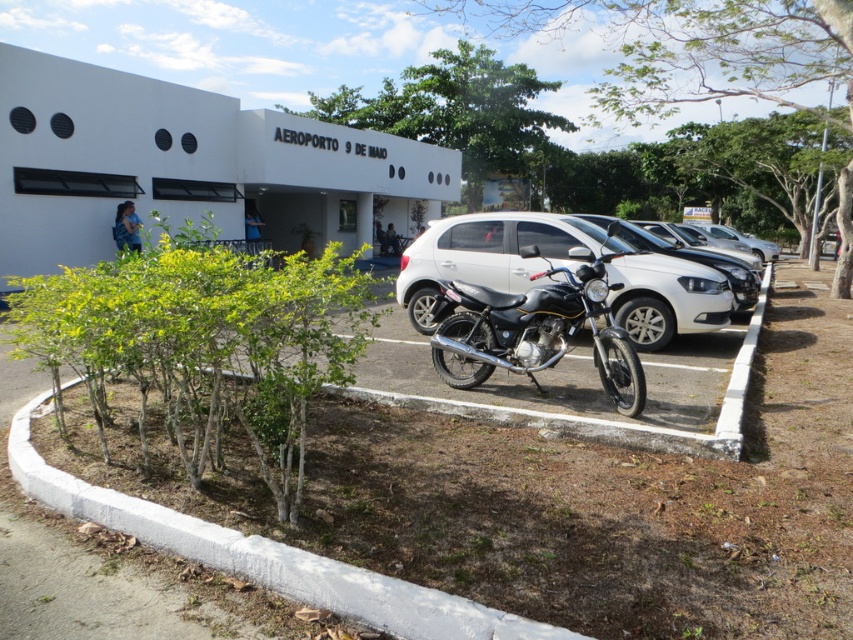
Question: Which point is closer to the camera?

Choices:
 (A) (454, 243)
 (B) (619, 230)

Answer: (A)

Question: Which of these objects is positioned farthest from the black matte motorcycle at center?

Choices:
 (A) glossy white sedan at center
 (B) satin white car at center

Answer: (A)

Question: Can you confirm if satin white car at center is bigger than black matte motorcycle at center?

Choices:
 (A) yes
 (B) no

Answer: (A)

Question: Is black matte motorcycle at center to the left of glossy white sedan at center from the viewer's perspective?

Choices:
 (A) yes
 (B) no

Answer: (A)

Question: Does satin white car at center have a lesser width compared to black matte motorcycle at center?

Choices:
 (A) yes
 (B) no

Answer: (B)

Question: Which of the following is the closest to the observer?

Choices:
 (A) black matte motorcycle at center
 (B) satin white car at center

Answer: (A)